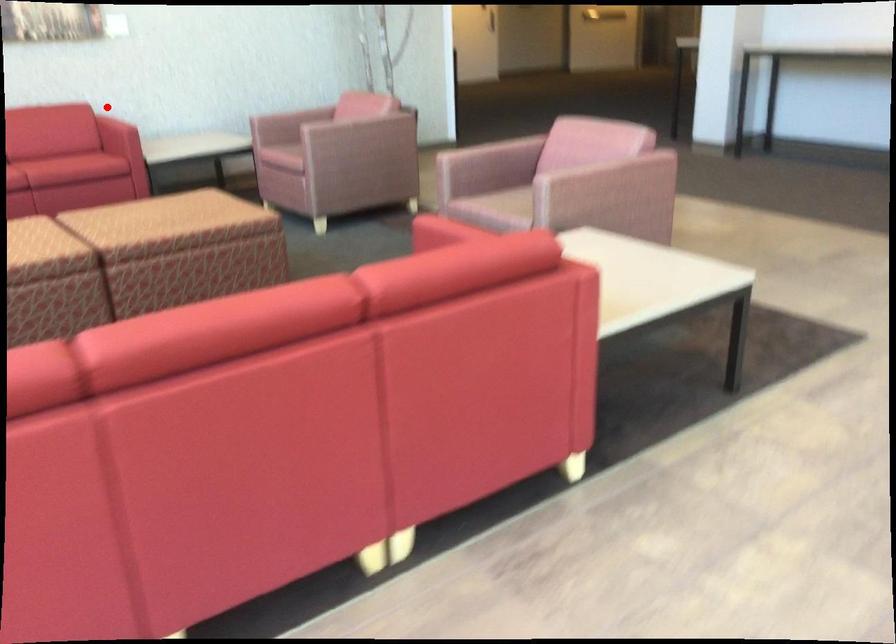
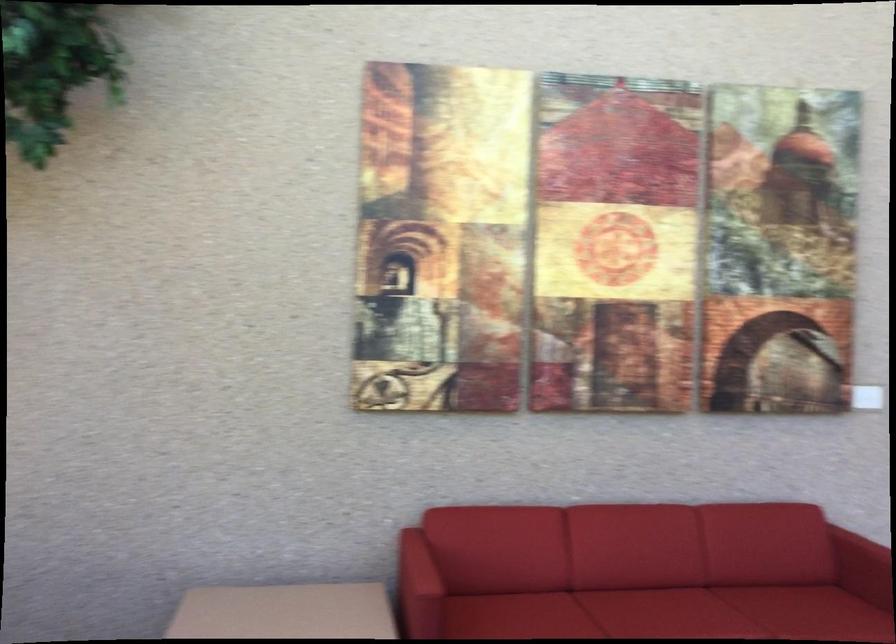
Locate, in the second image, the point that corresponds to the highlighted location in the first image.

(864, 558)